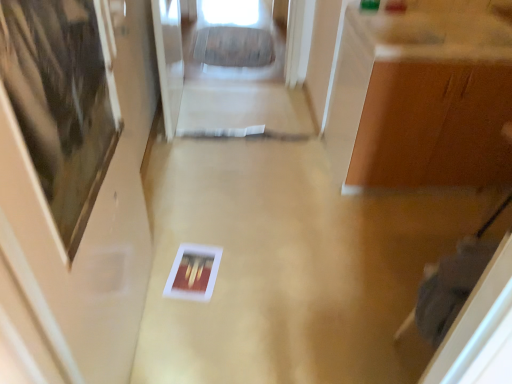
Question: Is matte wood door at left shorter than transparent glass door at upper center?

Choices:
 (A) yes
 (B) no

Answer: (B)

Question: Does matte wood door at left appear on the right side of transparent glass door at upper center?

Choices:
 (A) yes
 (B) no

Answer: (A)

Question: Is transparent glass door at upper center surrounded by matte wood door at left?

Choices:
 (A) no
 (B) yes

Answer: (A)

Question: Is matte wood door at left behind transparent glass door at upper center?

Choices:
 (A) no
 (B) yes

Answer: (A)

Question: Can you confirm if matte wood door at left is positioned to the left of transparent glass door at upper center?

Choices:
 (A) no
 (B) yes

Answer: (A)

Question: Does matte wood door at left turn towards transparent glass door at upper center?

Choices:
 (A) no
 (B) yes

Answer: (A)

Question: From a real-world perspective, is matte brown cabinet at upper right located beneath matte wood door at left?

Choices:
 (A) no
 (B) yes

Answer: (B)

Question: Can you confirm if matte brown cabinet at upper right is positioned to the right of matte wood door at left?

Choices:
 (A) no
 (B) yes

Answer: (B)

Question: Is matte brown cabinet at upper right shorter than matte wood door at left?

Choices:
 (A) no
 (B) yes

Answer: (B)

Question: Does matte brown cabinet at upper right appear on the left side of matte wood door at left?

Choices:
 (A) yes
 (B) no

Answer: (B)

Question: From a real-world perspective, is matte brown cabinet at upper right located higher than matte wood door at left?

Choices:
 (A) yes
 (B) no

Answer: (B)

Question: Is there a large distance between matte brown cabinet at upper right and matte wood door at left?

Choices:
 (A) yes
 (B) no

Answer: (A)

Question: Does matte wood door at left contain matte brown cabinet at upper right?

Choices:
 (A) no
 (B) yes

Answer: (A)